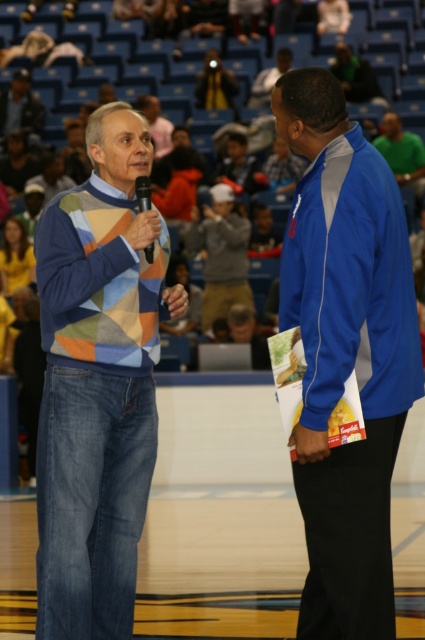
Question: Is patchwork sweater at left positioned in front of black plastic microphone at center?

Choices:
 (A) no
 (B) yes

Answer: (B)

Question: Which point appears farthest from the camera in this image?

Choices:
 (A) click(x=79, y=202)
 (B) click(x=152, y=244)
 (C) click(x=408, y=148)

Answer: (C)

Question: Can you confirm if patchwork sweater at left is smaller than black plastic microphone at center?

Choices:
 (A) no
 (B) yes

Answer: (A)

Question: Estimate the real-world distances between objects in this image. Which object is farther from the matte black jacket at upper left?

Choices:
 (A) blue fabric jacket at center
 (B) green jersey at upper right
 (C) patchwork sweater at left
 (D) black plastic microphone at center

Answer: (A)

Question: Which of the following is the closest to the observer?

Choices:
 (A) matte black jacket at upper left
 (B) patchwork sweater at left
 (C) black plastic microphone at center
 (D) blue fabric jacket at center

Answer: (D)

Question: Is patchwork sweater at left below black plastic microphone at center?

Choices:
 (A) yes
 (B) no

Answer: (A)